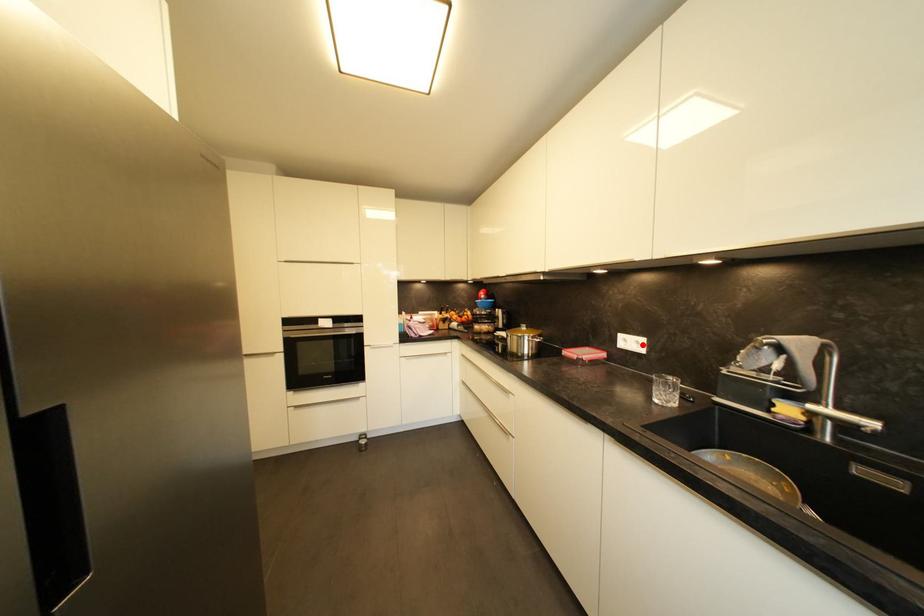
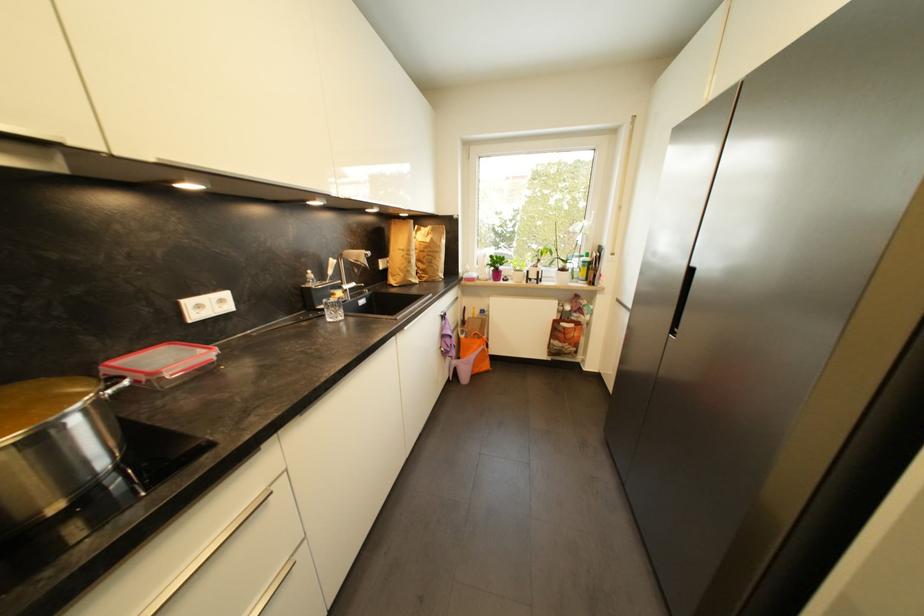
Where in the second image is the point corresponding to the highlighted location from the first image?

(226, 302)